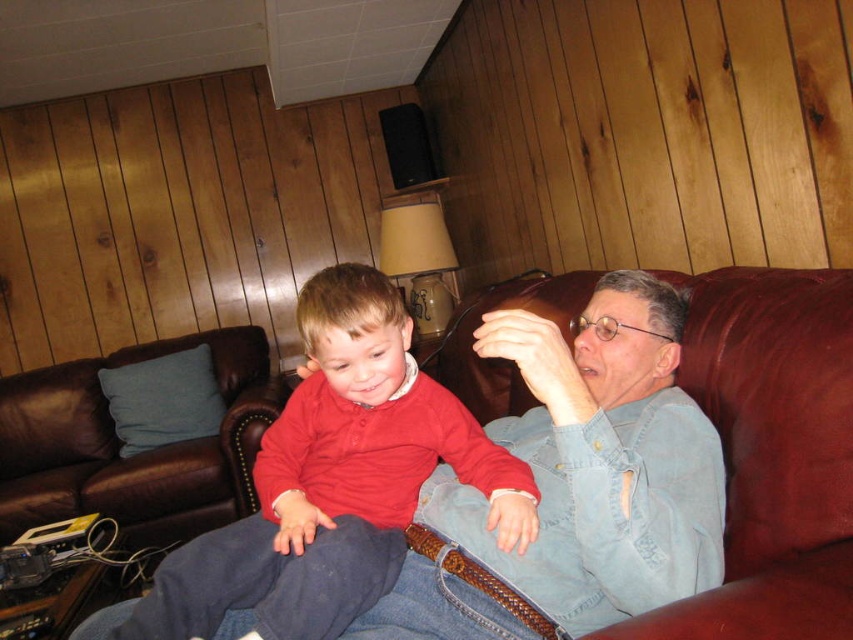
You are a delivery person standing at the entrance of the living room. You need to place a package between the red matte shirt at center and the matte red sweater at center. The package requires a space of 5 feet. Can you fit the package between them?

The red matte shirt at center is 6.15 feet away from the matte red sweater at center. Since the required space for the package is 5 feet, the distance between them is sufficient, so yes, the package can be placed between them.

You are standing in the living room and see the red leather couch. There is a point marked at coordinates (335, 481). Which object does this point belong to?

The point at coordinates (335, 481) is on the red matte shirt at center.

Consider the image. You are standing in the living room and need to locate the red matte shirt at center. According to the coordinates provided, where exactly is it positioned?

The red matte shirt at center is located at point coordinates 0.752 on the x axis and 0.395 on the y axis.